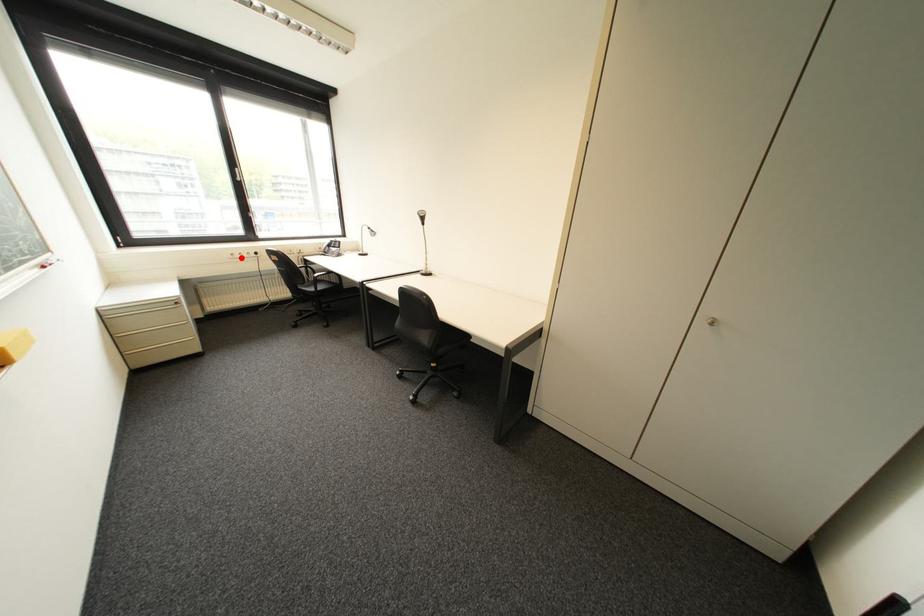
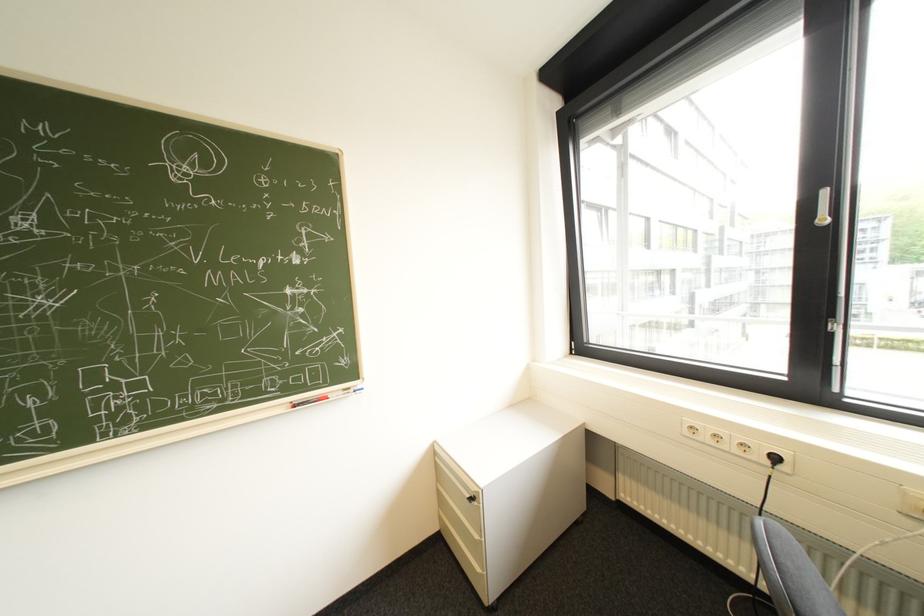
Question: I am providing you with two images of the same scene from different viewpoints. In image1, a red point is highlighted. Considering the same 3D point in image2, which of the following is correct?

Choices:
 (A) It is closer
 (B) It is farther

Answer: (B)